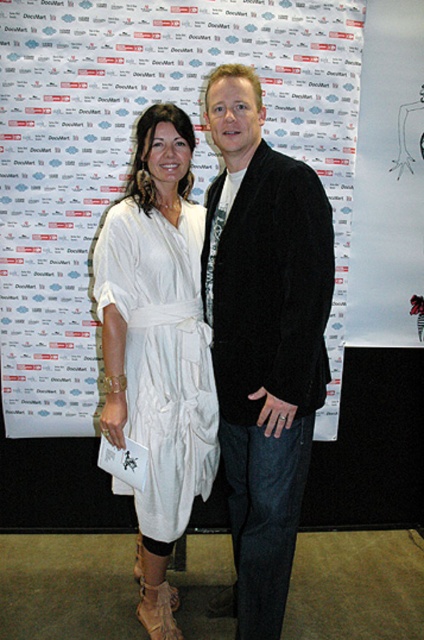
Which is behind, point (145, 3) or point (273, 355)?

Point (145, 3)

Which is more to the right, white paper at center or black fuzzy jacket at center?

black fuzzy jacket at center

At what (x,y) coordinates should I click in order to perform the action: click on white paper at center. Please return your answer as a coordinate pair (x, y). The height and width of the screenshot is (640, 424). Looking at the image, I should click on (130, 156).

Can you confirm if white paper at center is wider than white cotton dress at center?

Yes, white paper at center is wider than white cotton dress at center.

Can you confirm if white paper at center is thinner than white cotton dress at center?

No.

The width and height of the screenshot is (424, 640). In order to click on white paper at center in this screenshot , I will do `click(130, 156)`.

Can you confirm if black fuzzy jacket at center is positioned to the left of white cotton dress at center?

No, black fuzzy jacket at center is not to the left of white cotton dress at center.

Between point (234, 211) and point (198, 413), which one is positioned in front?

Point (234, 211) is more forward.

You are a GUI agent. You are given a task and a screenshot of the screen. Output one action in this format:
    pyautogui.click(x=<x>, y=<y>)
    Task: Click on the black fuzzy jacket at center
    
    Given the screenshot: What is the action you would take?
    pyautogui.click(x=264, y=339)